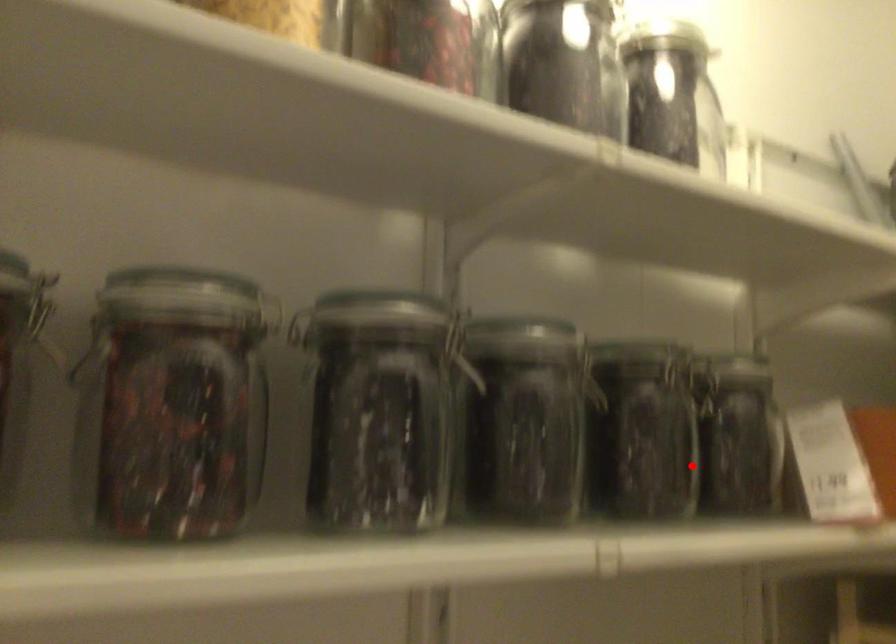
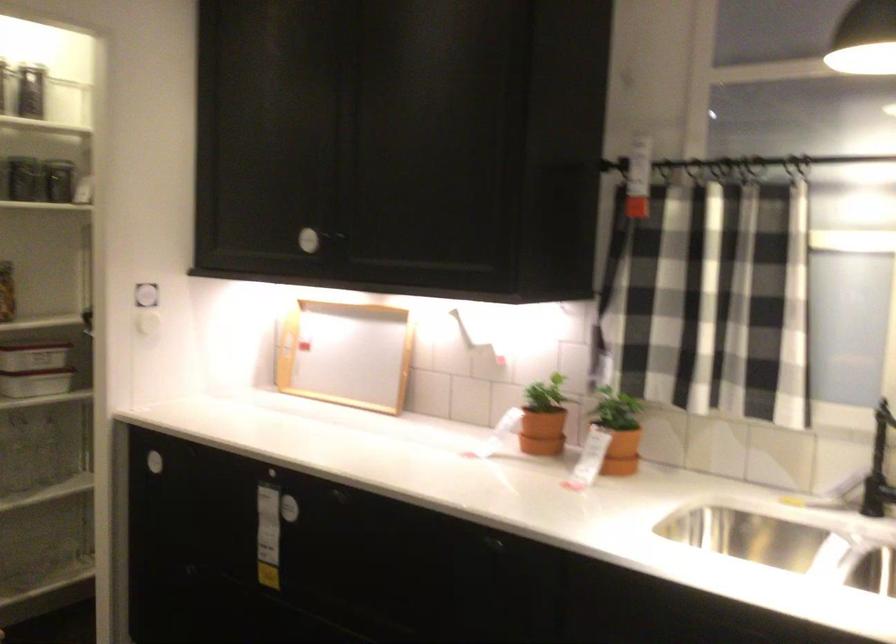
Question: I am providing you with two images of the same scene from different viewpoints. A red point is shown in image1. For the corresponding object point in image2, is it positioned nearer or farther from the camera?

Choices:
 (A) Nearer
 (B) Farther

Answer: (B)